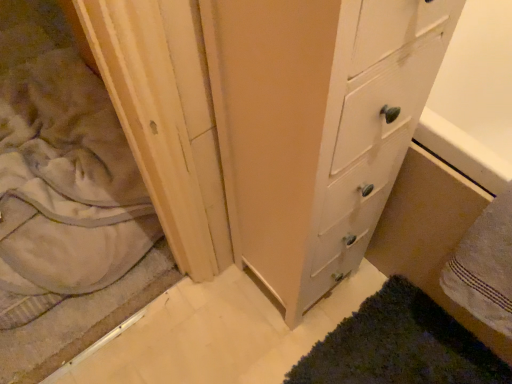
You are a GUI agent. You are given a task and a screenshot of the screen. Output one action in this format:
    pyautogui.click(x=<x>, y=<y>)
    Task: Click on the vacant region below dark green shaggy bath mat at lower right (from a real-world perspective)
    Image resolution: width=512 pixels, height=384 pixels.
    Given the screenshot: What is the action you would take?
    pyautogui.click(x=390, y=355)